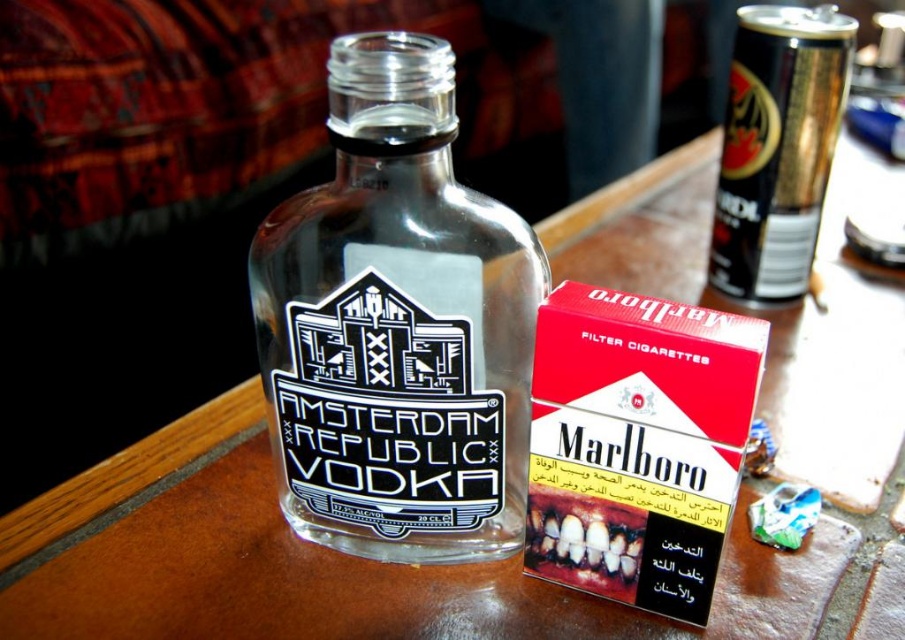
You are organizing items on a shelf and need to place the transparent glass bottle at center and the black metallic can at upper right. If the shelf has a width of 15 cm, can both items fit side by side without overlapping?

The transparent glass bottle at center might be wider than black metallic can at upper right. Since the shelf is only 15 cm wide, it is uncertain if both items can fit side by side without overlapping. The width of the bottle compared to the can is critical here.

Please describe the exact position of the transparent glass bottle at center on the table in terms of coordinates?

The transparent glass bottle at center is located at coordinates point (397, 324).

You are a delivery person holding a measuring tape. You need to place a protective cover over the transparent glass bottle at center. The cover requires the distance from the bottle to the viewer to be exactly 20 inches. Is the current distance sufficient?

The transparent glass bottle at center is currently 19.15 inches away from the viewer, which is slightly less than the required 20 inches. Therefore, the current distance is not sufficient for the protective cover.